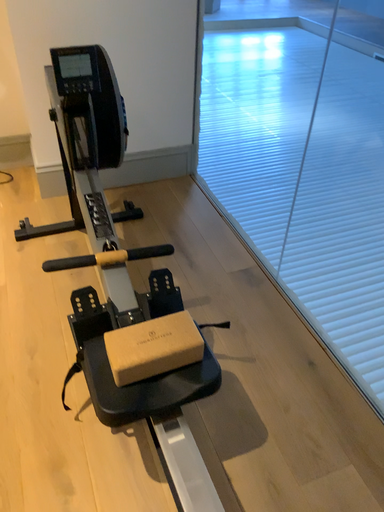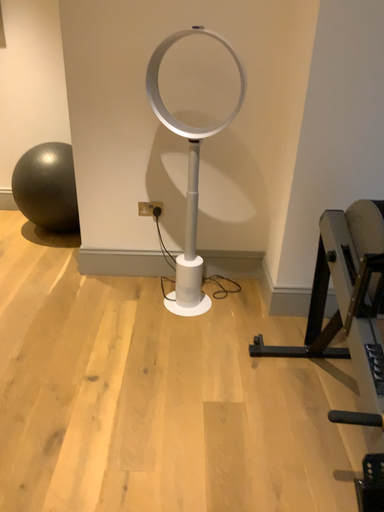
Question: How did the camera likely rotate when shooting the video?

Choices:
 (A) rotated downward
 (B) rotated upward

Answer: (B)